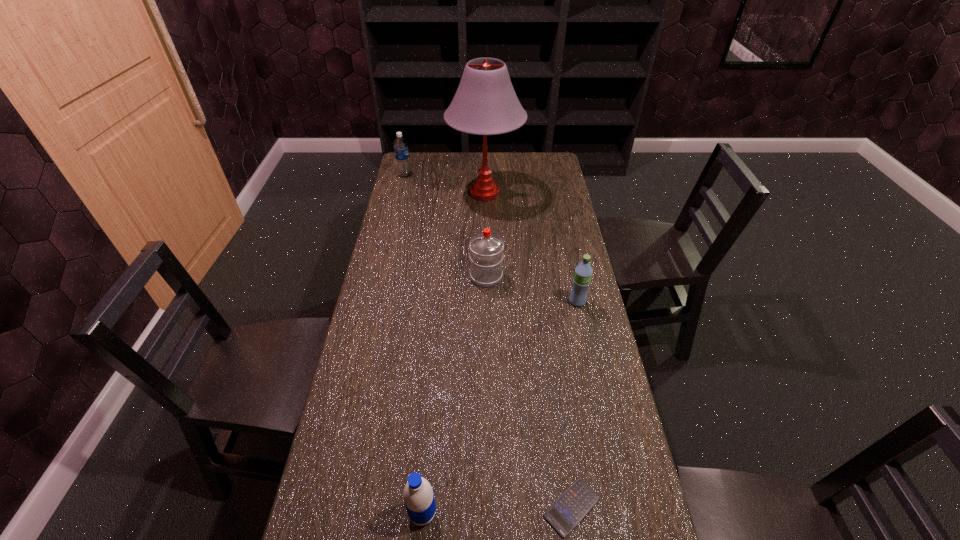
Find the location of a particular element. This screenshot has width=960, height=540. the tallest object is located at coordinates (485, 103).

Identify the location of the leftmost water bottle. (400, 145).

Image resolution: width=960 pixels, height=540 pixels. I want to click on the farthest water bottle, so click(x=400, y=145).

This screenshot has height=540, width=960. I want to click on the second water bottle from right to left, so click(x=486, y=256).

Where is `the fourth nearest object`? the fourth nearest object is located at coordinates (486, 256).

Where is `the third farthest water bottle`? The width and height of the screenshot is (960, 540). the third farthest water bottle is located at coordinates (583, 272).

Where is `the rightmost water bottle`? the rightmost water bottle is located at coordinates (583, 272).

Find the location of a particular element. This screenshot has width=960, height=540. the nearest water bottle is located at coordinates (418, 495).

Locate an element on the screen. Image resolution: width=960 pixels, height=540 pixels. the shortest object is located at coordinates (573, 505).

Locate an element on the screen. This screenshot has width=960, height=540. vacant space situated 0.220m on the front-facing side of the tallest object is located at coordinates (397, 193).